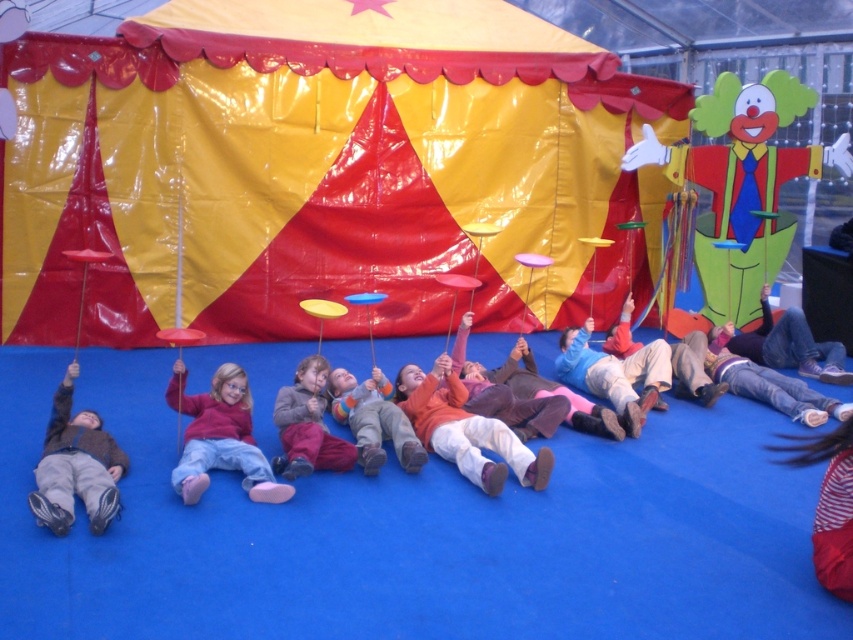
Question: Does matte gray sweater at center appear on the left side of orange fleece sweater at center?

Choices:
 (A) no
 (B) yes

Answer: (B)

Question: Which point is farther to the camera?

Choices:
 (A) orange fleece sweater at center
 (B) denim jeans at lower right
 (C) matte pink pants at center
 (D) yellow/red fabric tent at upper center

Answer: (B)

Question: Observing the image, what is the correct spatial positioning of orange sweater at center in reference to dark brown jacket at lower left?

Choices:
 (A) left
 (B) right

Answer: (B)

Question: Is matte gray sweater at center further to the viewer compared to orange fleece sweater at center?

Choices:
 (A) yes
 (B) no

Answer: (B)

Question: Which object is farther from the camera taking this photo?

Choices:
 (A) dark brown jacket at lower left
 (B) orange fleece sweater at center
 (C) denim jeans at lower right

Answer: (C)

Question: Estimate the real-world distances between objects in this image. Which object is closer to the orange fleece sweater at center?

Choices:
 (A) orange sweater at center
 (B) yellow/red fabric tent at upper center
 (C) dark brown jacket at lower left

Answer: (A)